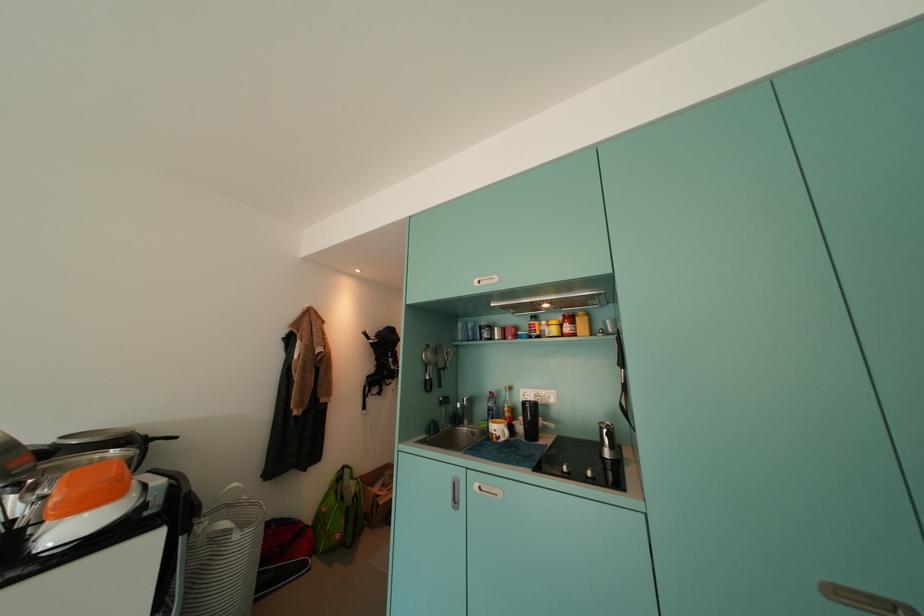
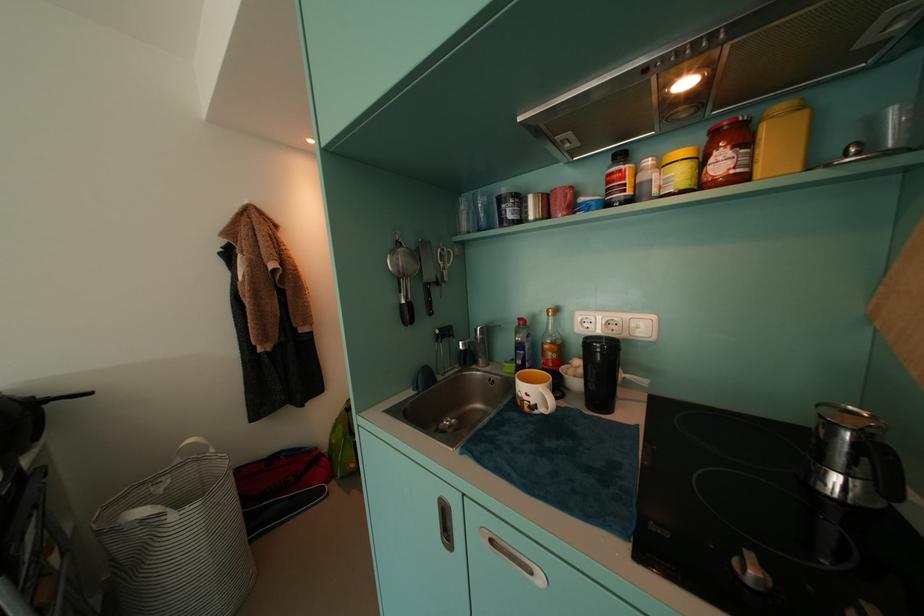
In the second image, find the point that corresponds to (472,424) in the first image.

(488, 363)